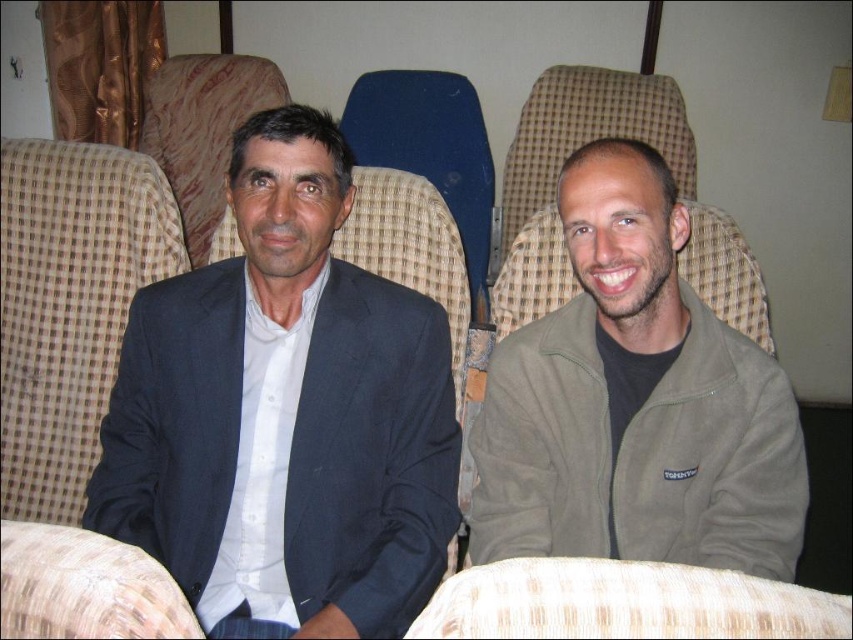
You are planning to sit between the dark blue suit at center and the matte green jacket at right. Which side should you choose if you want to have more space on your left side?

You should sit on the side of the dark blue suit at center because its width is greater than the matte green jacket at right, providing more space on your left side.

Looking at this image, you are a photographer setting up for a group portrait. You need to position two subjects so they are exactly 12 inches apart. Given the current setup with the dark blue suit at center and the matte green jacket at right, can they move closer to meet the requirement?

The current distance between the dark blue suit at center and the matte green jacket at right is 10.78 inches. Since 10.78 inches is less than 12 inches, they are already closer than the required distance. To meet the 12 inches requirement, they would need to move slightly apart instead of closer.